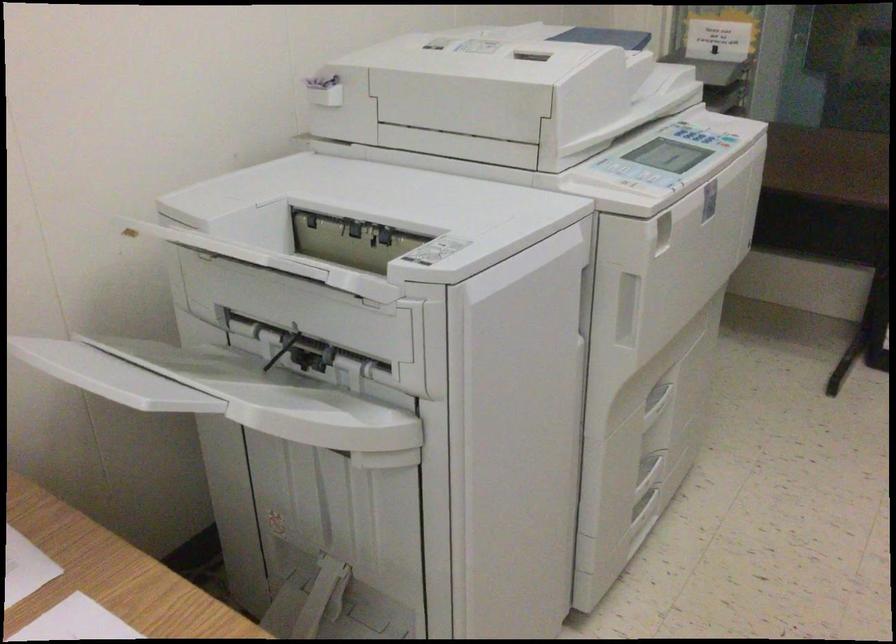
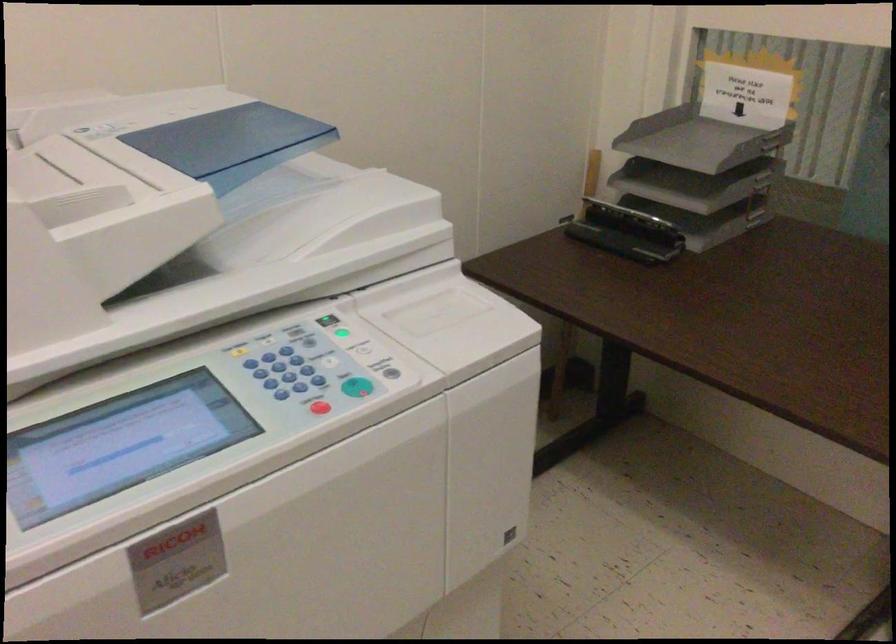
What movement of the cameraman would produce the second image?

The cameraman moved toward right, forward.